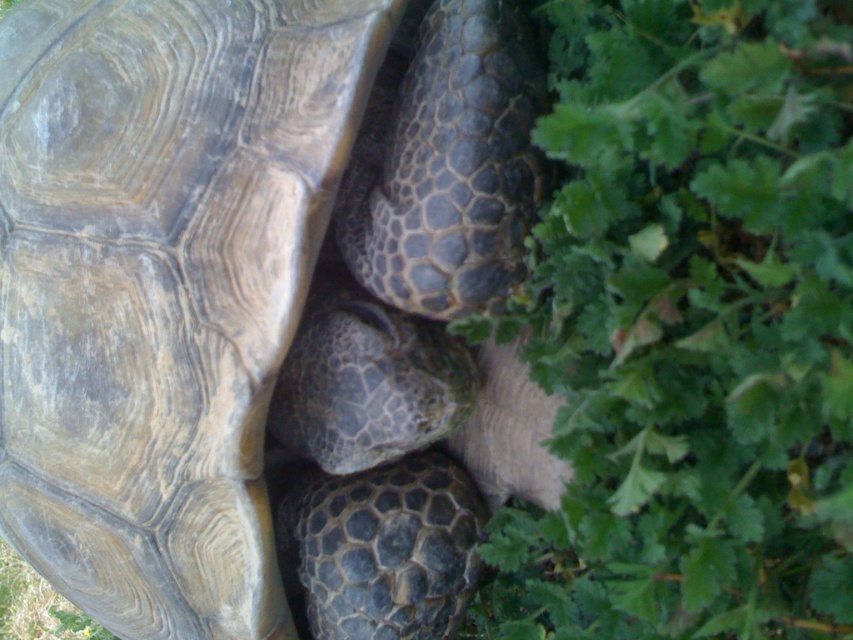
You are a small insect observing the scene from above. You see the leathery brown tortoise at center and the green leafy plant at lower right. Which object is closer to your left side?

The leathery brown tortoise at center is positioned on the left side of the green leafy plant at lower right, so from your perspective above, the leathery brown tortoise at center is closer to your left side.

You are a gardener who wants to place a small decorative rock between the leathery brown tortoise at center and the green leafy plant at lower right. Which object should you place the rock closer to if you want it to be closer to the taller one?

The leathery brown tortoise at center is taller than the green leafy plant at lower right. Therefore, to place the rock closer to the taller one, you should position it nearer to the leathery brown tortoise at center.

You are a small insect located on the green leafy plant at lower right. The leathery brown tortoise at center is moving towards you. If the tortoise moves at a speed of 1 inch per minute, how many minutes will it take for the tortoise to reach you?

The distance between the leathery brown tortoise at center and the green leafy plant at lower right is 9.12 inches. Since the tortoise moves at 1 inch per minute, it will take 9.12 minutes to reach the green leafy plant at lower right.